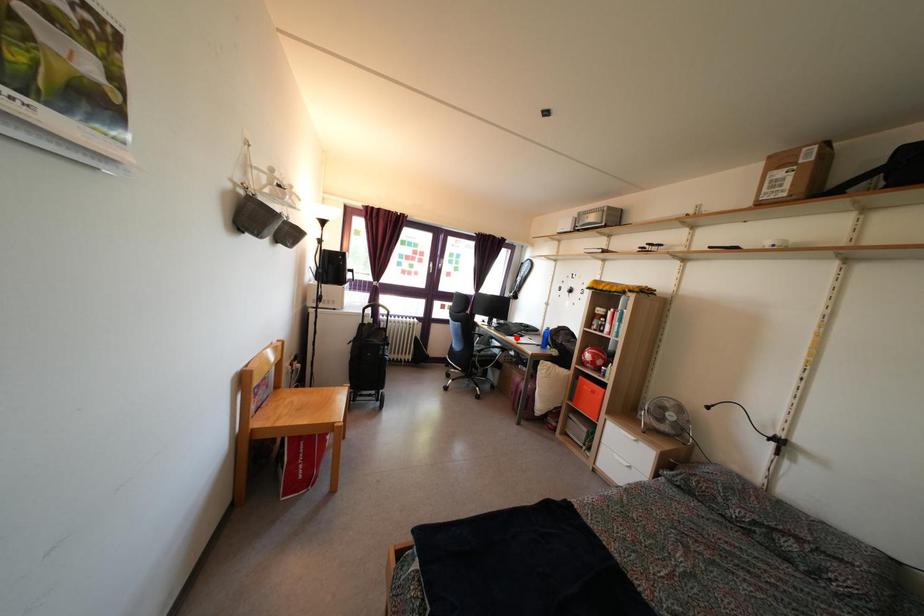
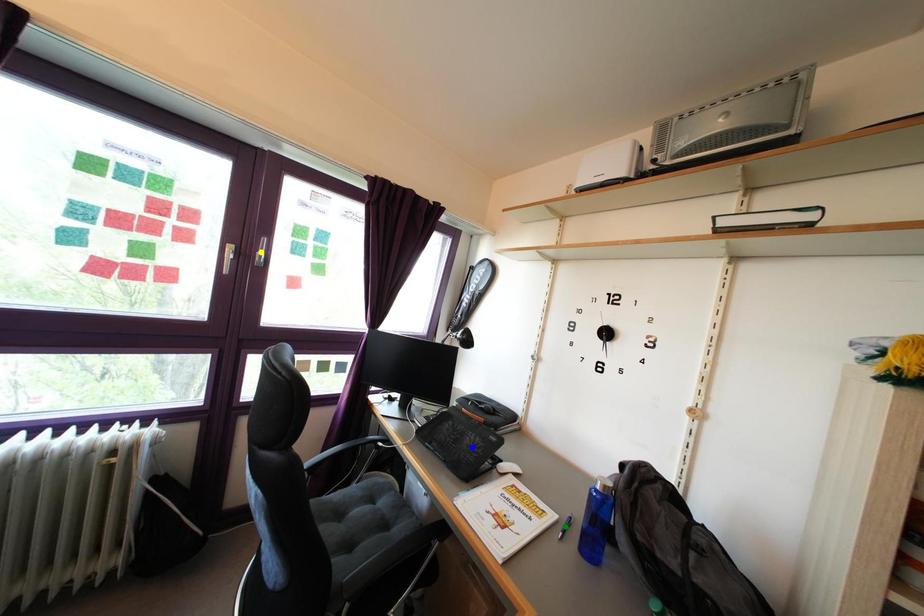
Question: I am providing you with two images of the same scene from different viewpoints. A red point is marked on the first image. You are given multiple points on the second image. Which point in image 2 represents the same 3d spot as the red point in image 1?

Choices:
 (A) blue point
 (B) green point
 (C) yellow point

Answer: (A)